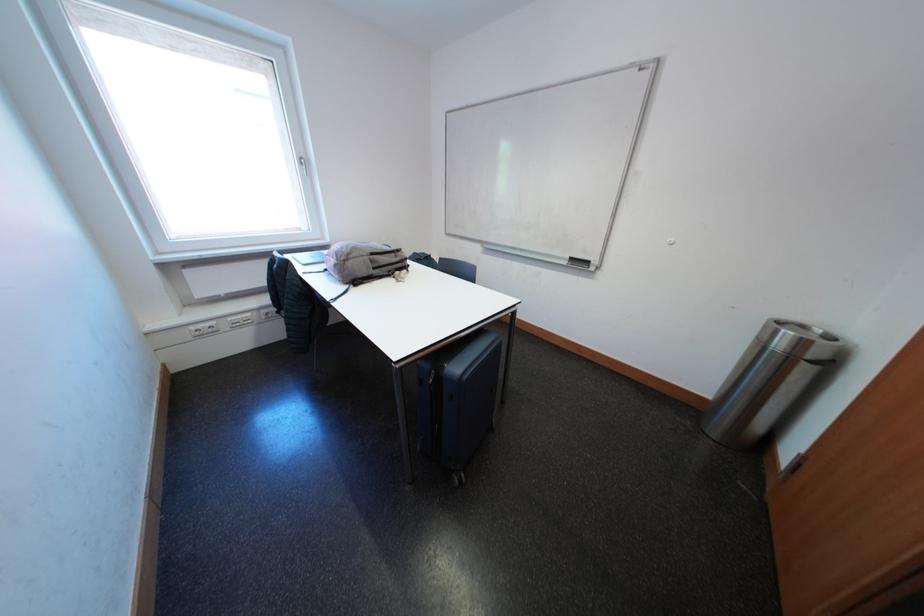
What do you see at coordinates (301, 315) in the screenshot? The height and width of the screenshot is (616, 924). I see `the chair sitting surface` at bounding box center [301, 315].